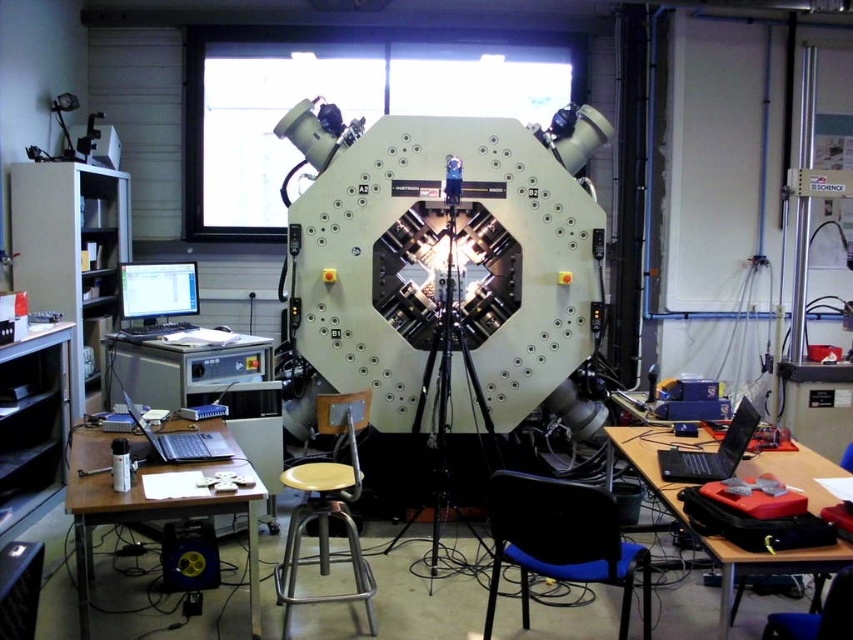
Question: Which object appears farthest from the camera in this image?

Choices:
 (A) matte black laptop at left
 (B) blue plastic chair at lower right
 (C) metallic tripod at center
 (D) yellow matte stool at center

Answer: (A)

Question: Is brown wooden table at lower left wider than silver metallic laptop at lower left?

Choices:
 (A) yes
 (B) no

Answer: (A)

Question: Estimate the real-world distances between objects in this image. Which object is farther from the blue plastic chair at lower right?

Choices:
 (A) matte black laptop at left
 (B) black glossy laptop at right
 (C) brown wooden table at lower left

Answer: (A)

Question: Is metallic tripod at center to the left of matte black laptop at left from the viewer's perspective?

Choices:
 (A) yes
 (B) no

Answer: (B)

Question: Can you confirm if black glossy laptop at right is thinner than blue plastic chair at lower right?

Choices:
 (A) no
 (B) yes

Answer: (A)

Question: Among these points, which one is nearest to the camera?

Choices:
 (A) (729, 444)
 (B) (328, 566)
 (C) (445, 483)

Answer: (A)